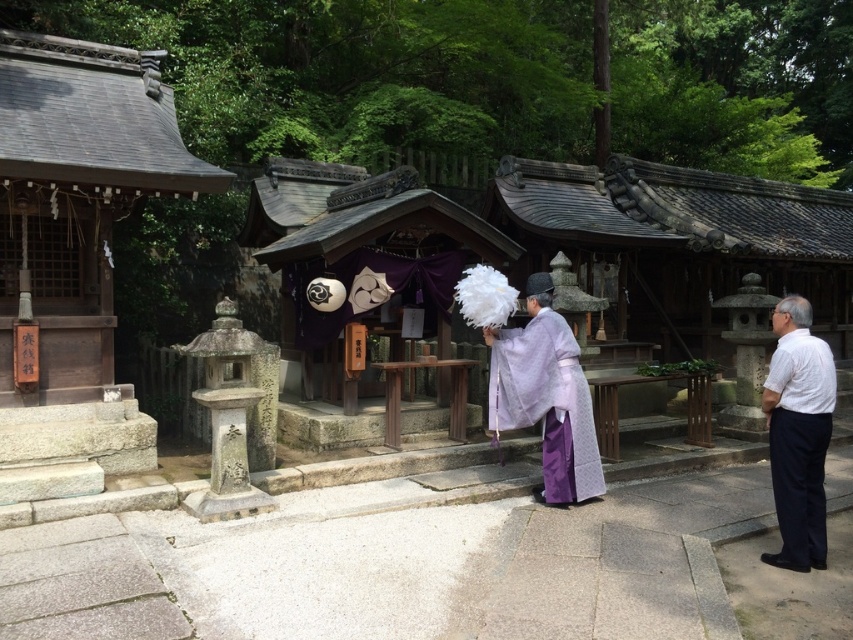
You are a visitor at the shrine and see the purple silk kimono at center and the purple satin robe at center. Which one is covering the other?

The purple silk kimono at center is positioned over the purple satin robe at center, so the kimono is covering the robe.

You are standing in front of the shrine and want to take a photo that includes both the stone lantern and the signboard. The camera can only focus on one point at a time. Which point should you focus on to ensure both objects are in focus? The points are point 1 at coordinates point (x=498, y=369) and point 2 at coordinates point (x=556, y=376). Please choose between point 1 or point 2.

You should focus on point 1 at coordinates point (x=498, y=369) because it is closer to the camera than point 2 at coordinates point (x=556, y=376). By focusing on the closer point, the depth of field will likely include both objects in focus.

You are a visitor at the shrine and notice two clothing items displayed on a rack near the entrance. The purple silk kimono at center and the white cotton shirt at right. Which clothing item is covering part of the other?

The purple silk kimono at center is positioned over the white cotton shirt at right, meaning it is covering part of the white cotton shirt at right.